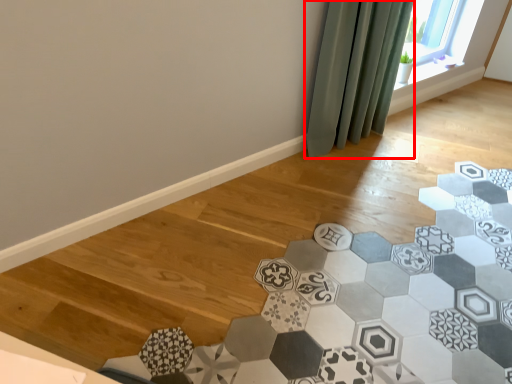
Question: From the image's perspective, what is the correct spatial positioning of curtain (annotated by the red box) in reference to ceramic tile?

Choices:
 (A) below
 (B) above

Answer: (B)